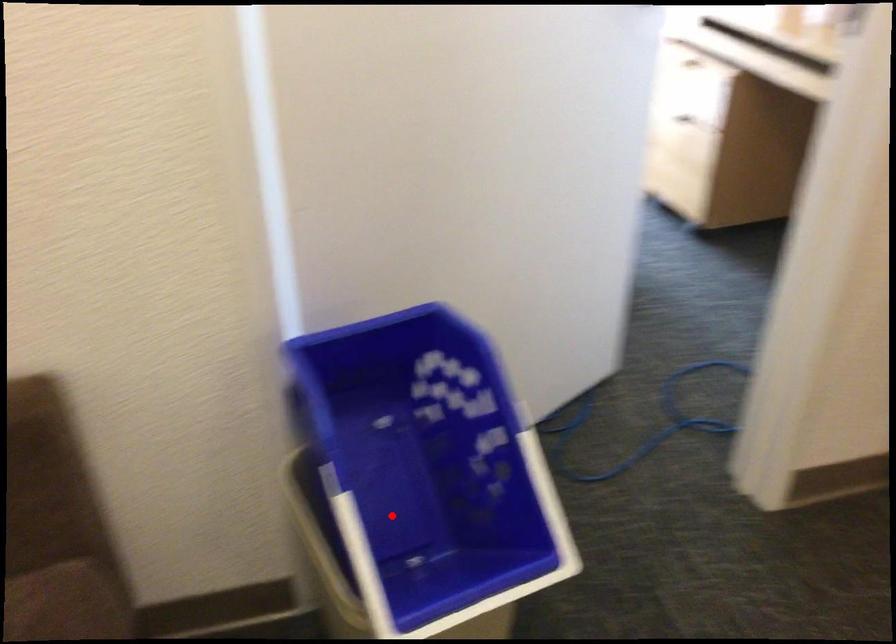
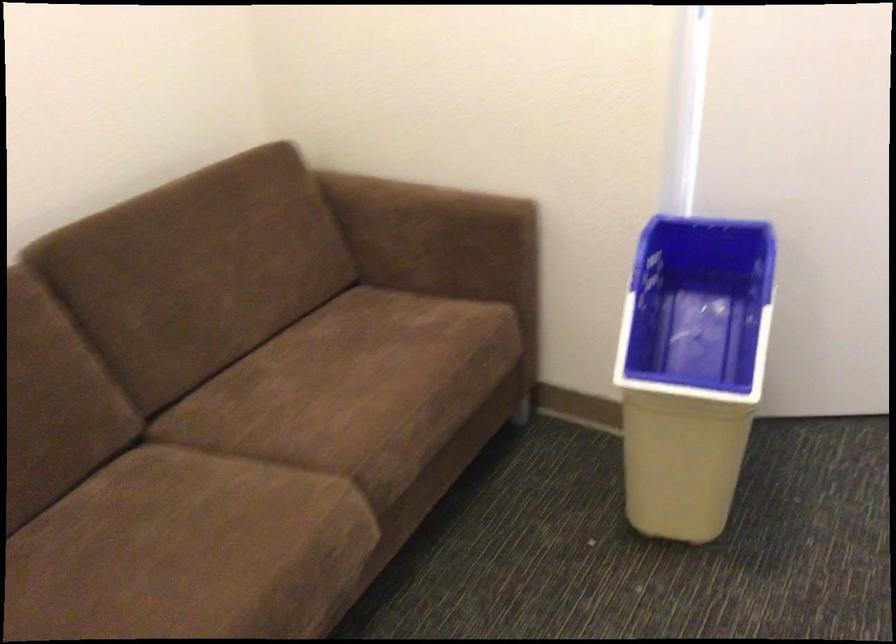
Question: I am providing you with two images of the same scene from different viewpoints. Image1 has a red point marked. In image2, the corresponding 3D location appears at what relative position? Reply with the corresponding letter.

Choices:
 (A) Closer
 (B) Farther

Answer: (B)